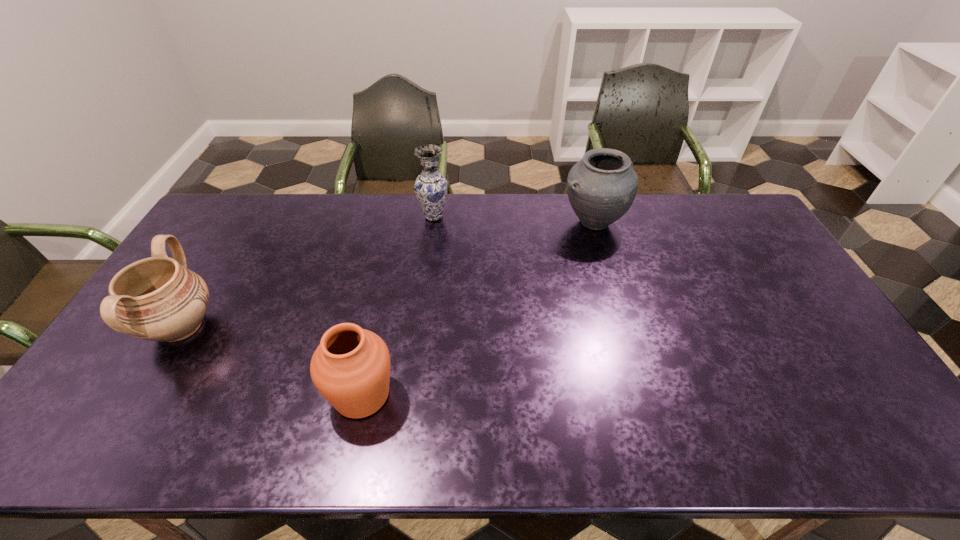
Image resolution: width=960 pixels, height=540 pixels. Identify the location of urn that is at the far edge. (601, 187).

Locate an element on the screen. The image size is (960, 540). object that is positioned at the near edge is located at coordinates (351, 367).

Identify the location of object located in the left edge section of the desktop. The width and height of the screenshot is (960, 540). (x=157, y=299).

This screenshot has width=960, height=540. I want to click on free space at the far edge, so click(262, 228).

At what (x,y) coordinates should I click in order to perform the action: click on blank space at the near edge of the desktop. Please return your answer as a coordinate pair (x, y). The height and width of the screenshot is (540, 960). Looking at the image, I should click on (644, 435).

Find the location of a particular element. vacant space at the left edge of the desktop is located at coordinates (204, 278).

At what (x,y) coordinates should I click in order to perform the action: click on free space at the right edge of the desktop. Please return your answer as a coordinate pair (x, y). The image size is (960, 540). Looking at the image, I should click on (800, 296).

You are a GUI agent. You are given a task and a screenshot of the screen. Output one action in this format:
    pyautogui.click(x=<x>, y=<y>)
    Task: Click on the unoccupied position between the rightmost urn and the vase
    This screenshot has height=540, width=960.
    Given the screenshot: What is the action you would take?
    pyautogui.click(x=514, y=220)

Where is `free space between the vase and the leftmost urn`? free space between the vase and the leftmost urn is located at coordinates (307, 272).

I want to click on free spot between the rightmost urn and the second urn from right to left, so click(477, 308).